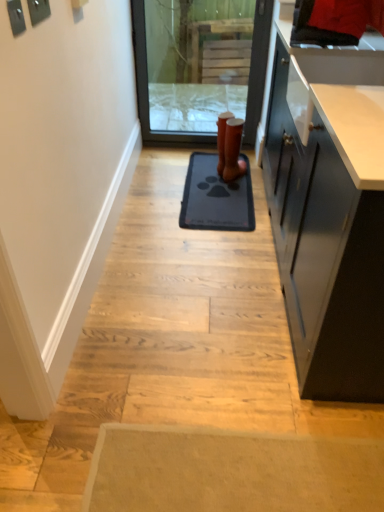
Question: From a real-world perspective, is gray rubber mat at center on top of brown leather boot at center?

Choices:
 (A) yes
 (B) no

Answer: (B)

Question: Is gray rubber mat at center oriented away from brown leather boot at center?

Choices:
 (A) no
 (B) yes

Answer: (A)

Question: Is gray rubber mat at center shorter than brown leather boot at center?

Choices:
 (A) yes
 (B) no

Answer: (A)

Question: Is gray rubber mat at center next to brown leather boot at center?

Choices:
 (A) yes
 (B) no

Answer: (B)

Question: Is gray rubber mat at center bigger than brown leather boot at center?

Choices:
 (A) yes
 (B) no

Answer: (A)

Question: From the image's perspective, is transparent glass screen door at center positioned above or below gray rubber mat at center?

Choices:
 (A) below
 (B) above

Answer: (B)

Question: Based on their positions, is transparent glass screen door at center located to the left or right of gray rubber mat at center?

Choices:
 (A) right
 (B) left

Answer: (B)

Question: Looking at their shapes, would you say transparent glass screen door at center is wider or thinner than gray rubber mat at center?

Choices:
 (A) wide
 (B) thin

Answer: (B)

Question: Is transparent glass screen door at center in front of or behind gray rubber mat at center in the image?

Choices:
 (A) front
 (B) behind

Answer: (B)

Question: From their relative heights in the image, would you say transparent glass screen door at center is taller or shorter than brown leather boot at center?

Choices:
 (A) short
 (B) tall

Answer: (B)

Question: In the image, is transparent glass screen door at center on the left side or the right side of brown leather boot at center?

Choices:
 (A) right
 (B) left

Answer: (B)

Question: Is point (140, 42) closer or farther from the camera than point (243, 167)?

Choices:
 (A) closer
 (B) farther

Answer: (A)

Question: In terms of size, does transparent glass screen door at center appear bigger or smaller than brown leather boot at center?

Choices:
 (A) small
 (B) big

Answer: (B)

Question: Is point (248, 177) positioned closer to the camera than point (226, 135)?

Choices:
 (A) farther
 (B) closer

Answer: (A)

Question: In terms of size, does gray rubber mat at center appear bigger or smaller than brown leather boot at center?

Choices:
 (A) small
 (B) big

Answer: (B)